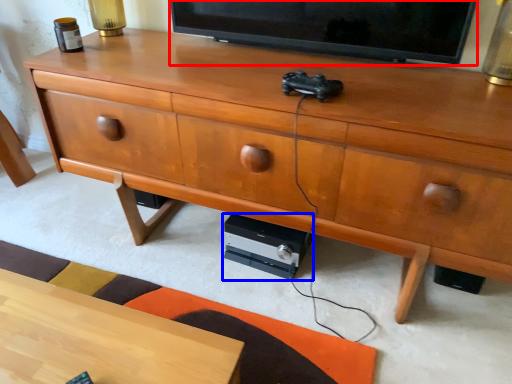
Question: Which point is closer to the camera, television (highlighted by a red box) or stereo (highlighted by a blue box)?

Choices:
 (A) television
 (B) stereo

Answer: (A)